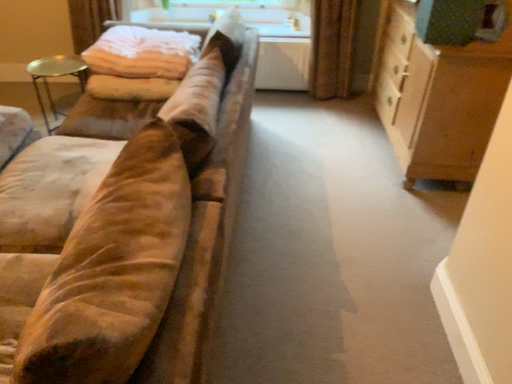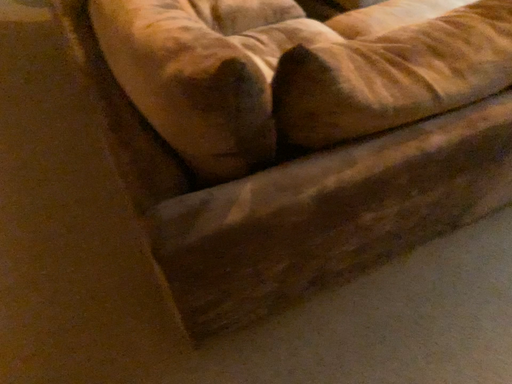
Question: Which way did the camera rotate in the video?

Choices:
 (A) rotated upward
 (B) rotated downward

Answer: (A)